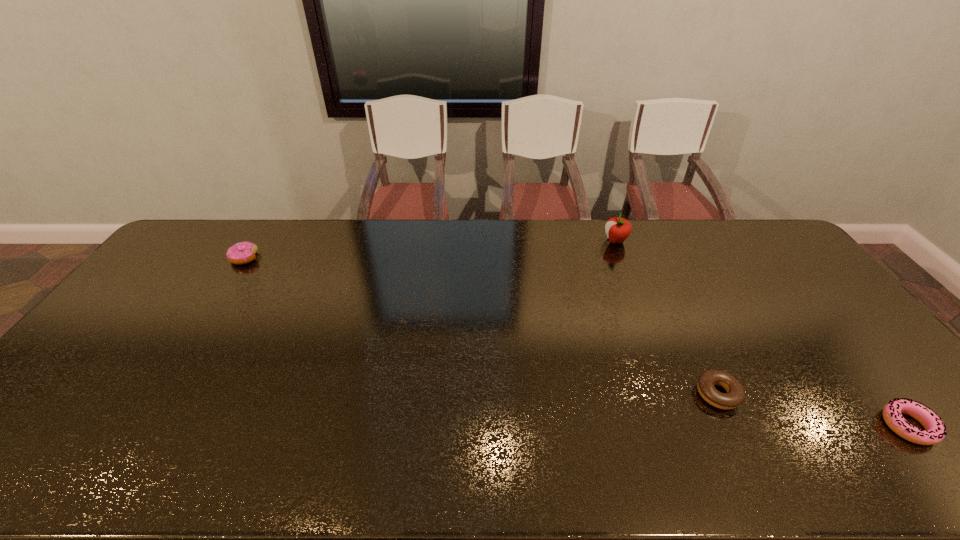
This screenshot has height=540, width=960. Find the location of `apple`. apple is located at coordinates (617, 229).

You are a GUI agent. You are given a task and a screenshot of the screen. Output one action in this format:
    pyautogui.click(x=<x>, y=<y>)
    Task: Click on the tallest object
    The height and width of the screenshot is (540, 960).
    Given the screenshot: What is the action you would take?
    pyautogui.click(x=617, y=229)

At what (x,y) coordinates should I click in order to perform the action: click on the leftmost doughnut. Please return your answer as a coordinate pair (x, y). Looking at the image, I should click on (240, 253).

You are a GUI agent. You are given a task and a screenshot of the screen. Output one action in this format:
    pyautogui.click(x=<x>, y=<y>)
    Task: Click on the leftmost object
    
    Given the screenshot: What is the action you would take?
    click(x=240, y=253)

Find the location of a particular element. The image size is (960, 540). the third object from left to right is located at coordinates (735, 396).

Where is `the rightmost doughnut`? The height and width of the screenshot is (540, 960). the rightmost doughnut is located at coordinates (935, 430).

The image size is (960, 540). I want to click on vacant space located on the front of the farthest object, so click(x=625, y=266).

The image size is (960, 540). I want to click on vacant region located on the right of the farthest doughnut, so (334, 258).

In order to click on free space located on the right of the second doughnut from right to left in this screenshot , I will do `click(795, 394)`.

At what (x,y) coordinates should I click in order to perform the action: click on vacant space located 0.200m on the back of the rightmost doughnut. Please return your answer as a coordinate pair (x, y). The image size is (960, 540). Looking at the image, I should click on (842, 343).